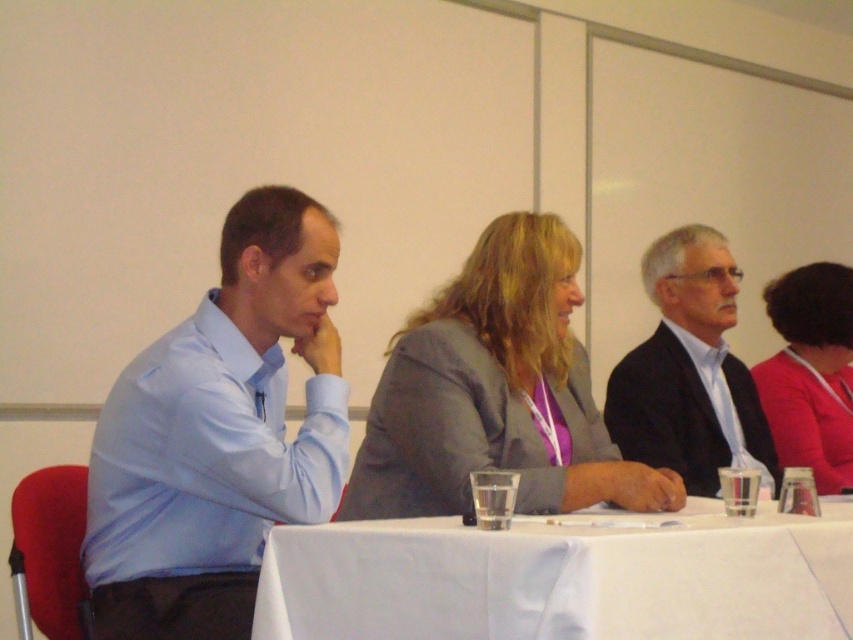
In the scene shown: Can you confirm if light blue shirt at left is bigger than dark gray suit at center?

Actually, light blue shirt at left might be smaller than dark gray suit at center.

Which is more to the right, light blue shirt at left or dark gray suit at center?

From the viewer's perspective, dark gray suit at center appears more on the right side.

Is point (223, 536) positioned behind point (717, 419)?

No, it is not.

Identify the location of light blue shirt at left. (218, 435).

Consider the image. Is white cloth at center closer to camera compared to gray fabric jacket at center?

That is True.

Can you confirm if white cloth at center is positioned below gray fabric jacket at center?

Indeed, white cloth at center is positioned under gray fabric jacket at center.

Is point (294, 634) positioned after point (641, 474)?

That is False.

You are a GUI agent. You are given a task and a screenshot of the screen. Output one action in this format:
    pyautogui.click(x=<x>, y=<y>)
    Task: Click on the white cloth at center
    
    Given the screenshot: What is the action you would take?
    pyautogui.click(x=564, y=577)

Which is more to the right, dark gray suit at center or pink fabric jacket at right?

pink fabric jacket at right

Does point (680, 314) come closer to viewer compared to point (836, 392)?

Yes, point (680, 314) is closer to viewer.

Find the location of a particular element. The height and width of the screenshot is (640, 853). dark gray suit at center is located at coordinates click(689, 371).